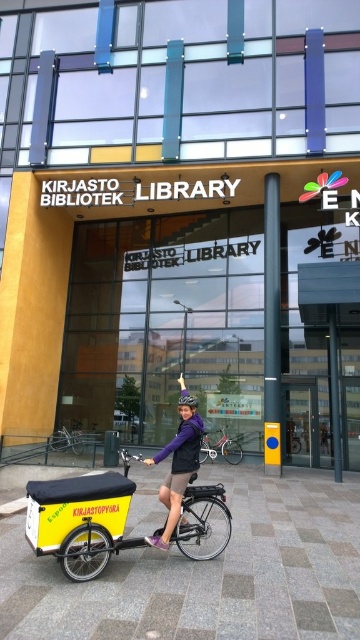
You are standing in front of the library and want to take a photo of the two points marked on the image. Which point, point (203, 451) or point (82, 440), will appear larger in your photo?

Point (203, 451) will appear larger in the photo because it is closer to the camera than point (82, 440).